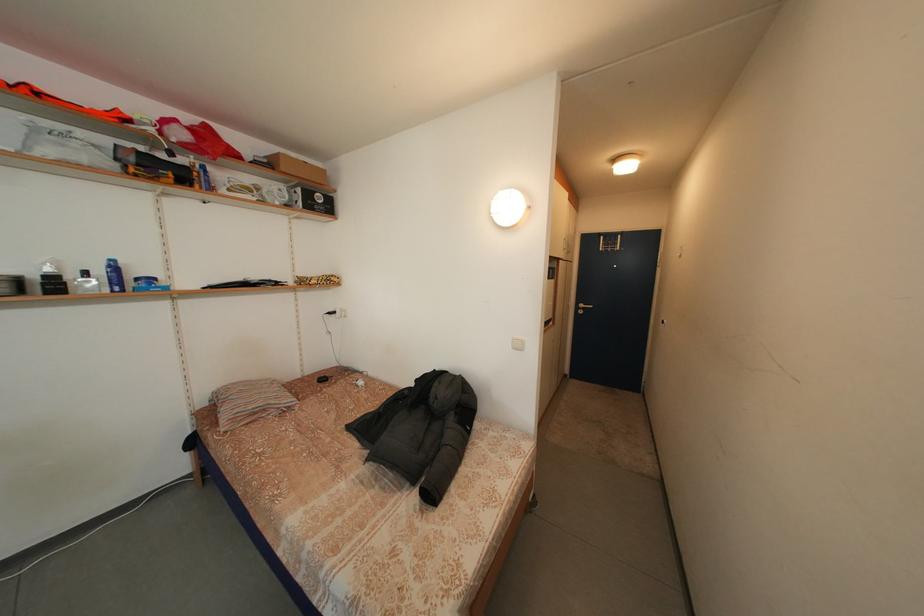
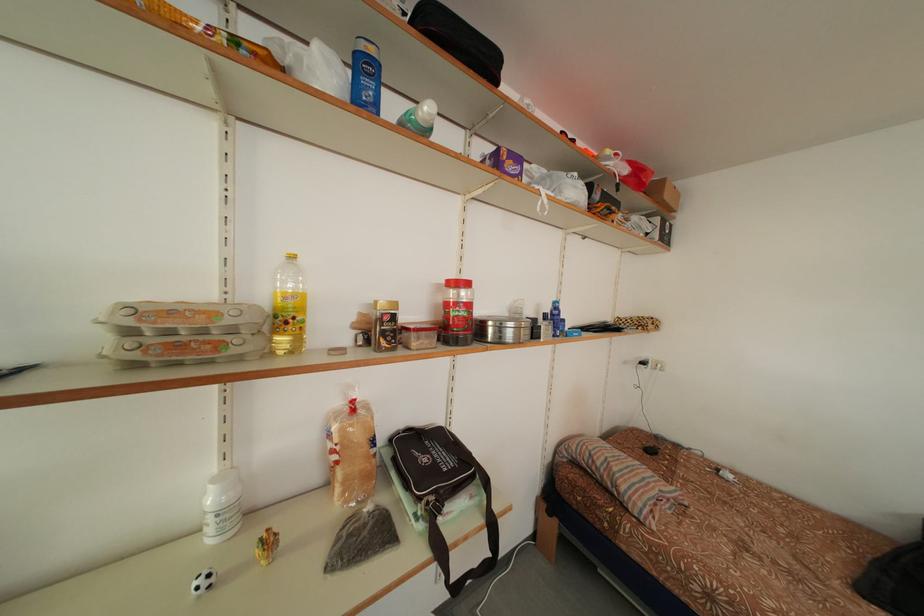
In the second image, find the point that corresponds to point (292, 175) in the first image.

(675, 201)